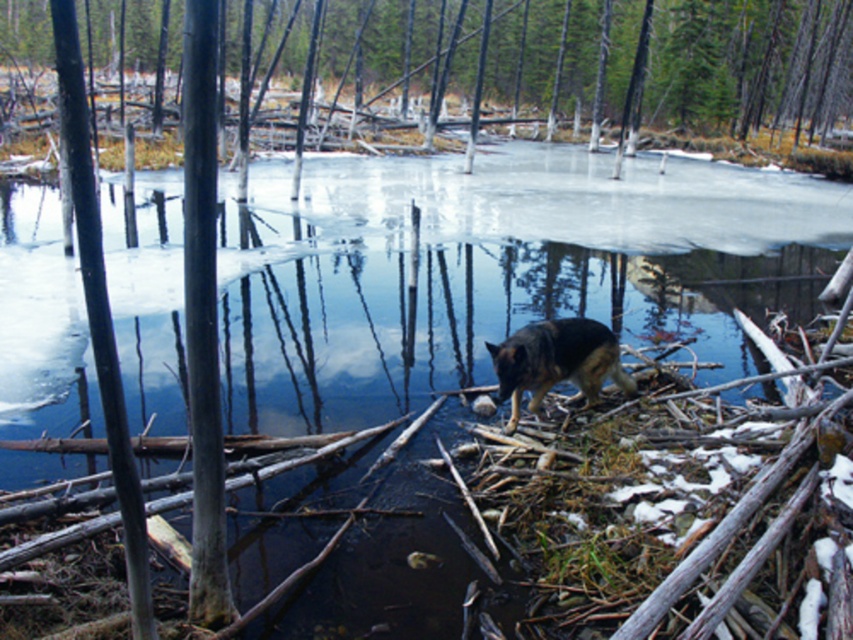
You are standing at the edge of the frozen water in the scene. You want to walk to the smooth bark tree at center. Is the tree within a 20 meter walking distance?

The smooth bark tree at center is 15.97 meters away from the viewer, so yes, it is within a 20 meter walking distance.

You are standing at the edge of the frozen water and want to reach the smooth bark tree at center. Which direction should you walk to get there?

The smooth bark tree at center is located at point [682,60], so you should walk towards the center of the image to reach it.

You are a hiker trying to navigate through the forest. You see the smooth bark tree at center and the dark brown fur dog at center. Which object is positioned to the left of the other?

The smooth bark tree at center is to the left of the dark brown fur dog at center.